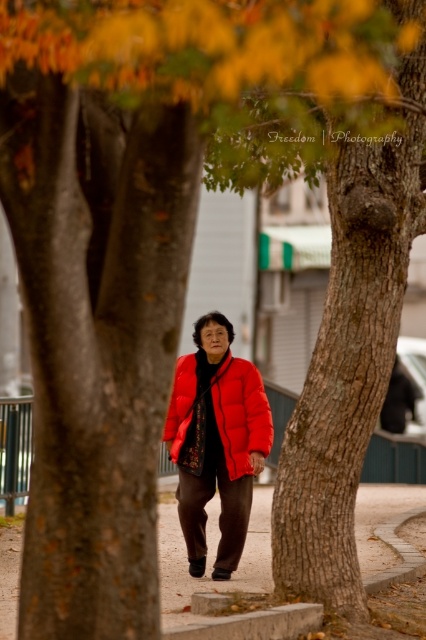
Between point (172, 541) and point (241, 412), which one is positioned in front?

Point (241, 412)

Image resolution: width=426 pixels, height=640 pixels. What do you see at coordinates (210, 556) in the screenshot?
I see `smooth concrete pavement at center` at bounding box center [210, 556].

At what (x,y) coordinates should I click in order to perform the action: click on smooth concrete pavement at center. Please return your answer as a coordinate pair (x, y). This screenshot has height=640, width=426. Looking at the image, I should click on (210, 556).

Identify the location of smooth concrete pavement at center. Image resolution: width=426 pixels, height=640 pixels. (210, 556).

Is matte red puffer jacket at center to the right of concrete curb at lower center from the viewer's perspective?

Incorrect, matte red puffer jacket at center is not on the right side of concrete curb at lower center.

Is matte red puffer jacket at center in front of concrete curb at lower center?

No, it is not.

Describe the element at coordinates (241, 413) in the screenshot. The height and width of the screenshot is (640, 426). I see `matte red puffer jacket at center` at that location.

Locate an element on the screen. matte red puffer jacket at center is located at coordinates (241, 413).

Who is shorter, smooth concrete pavement at center or concrete curb at lower center?

concrete curb at lower center is shorter.

Is smooth concrete pavement at center below concrete curb at lower center?

Yes.

Locate an element on the screen. This screenshot has height=640, width=426. smooth concrete pavement at center is located at coordinates (210, 556).

The width and height of the screenshot is (426, 640). What are the coordinates of `smooth concrete pavement at center` in the screenshot? It's located at (210, 556).